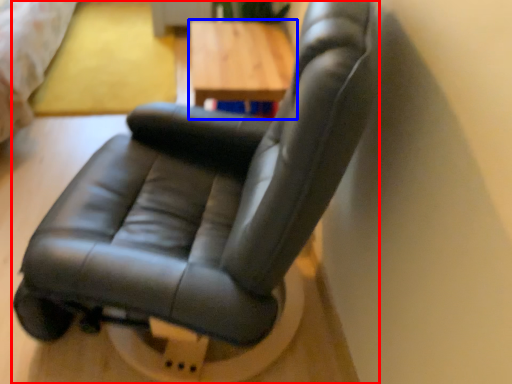
Question: Which object is closer to the camera taking this photo, chair (highlighted by a red box) or table (highlighted by a blue box)?

Choices:
 (A) chair
 (B) table

Answer: (A)